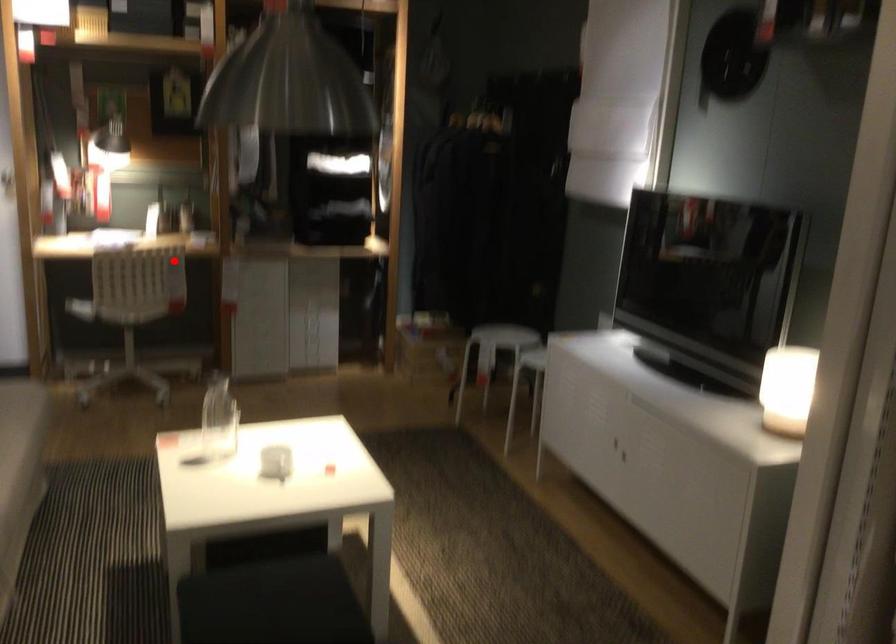
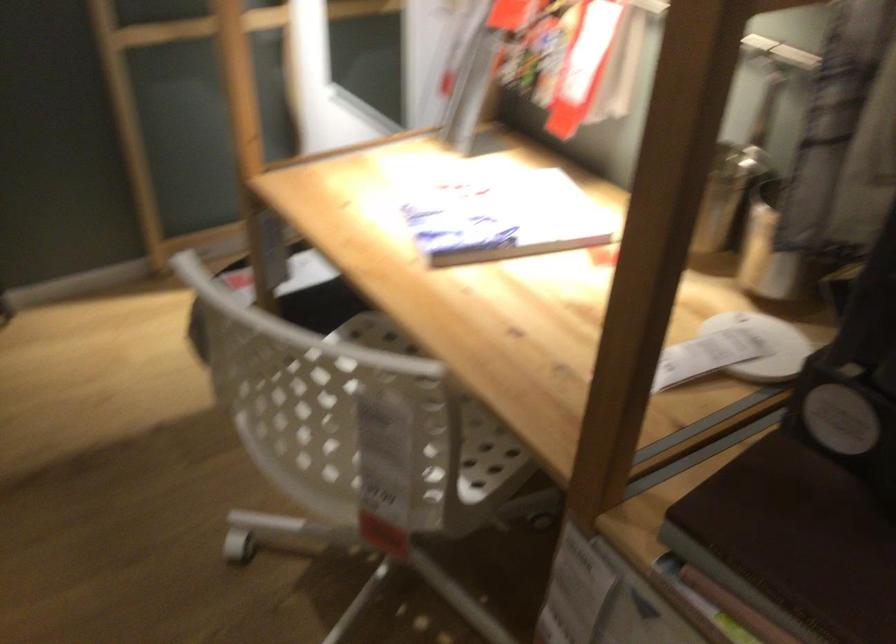
In the second image, find the point that corresponds to the highlighted location in the first image.

(371, 418)